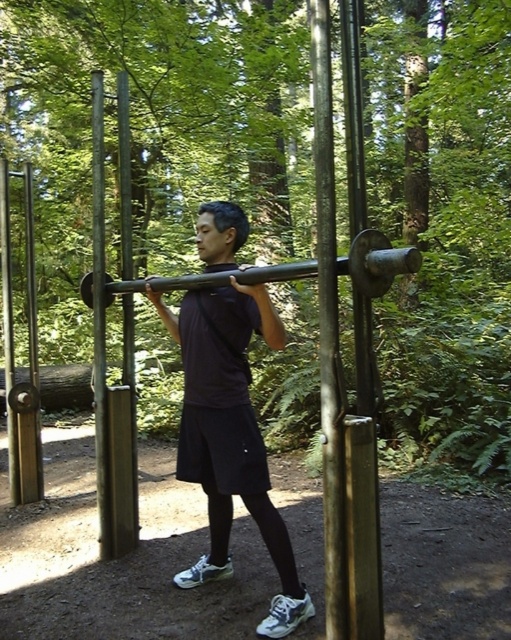
You are a photographer positioned at the origin point of the image. You want to capture a closeup shot of the matte black shirt at center. Based on its coordinates, which direction should you move your camera to focus on it?

The matte black shirt at center is located at coordinates point (229, 435). Since the origin point is at the bottom left corner of the image, moving the camera to the right and slightly upwards would align it with the shirt.

You are a fitness trainer assessing the scene. You notice the brushed metal pole at center and the black metal barbell at center. Which object is narrower in width?

The brushed metal pole at center has a lesser width compared to the black metal barbell at center, so the brushed metal pole at center is narrower.

You are a photographer setting up a shoot in the forest. You have two objects in the scene, the black metal barbell at center and the polished metal pole at center. Which object would you need to place a higher stand under to ensure both are at eye level?

The black metal barbell at center has a lesser height compared to the polished metal pole at center, so you would need to place a higher stand under the black metal barbell at center to bring it up to eye level.